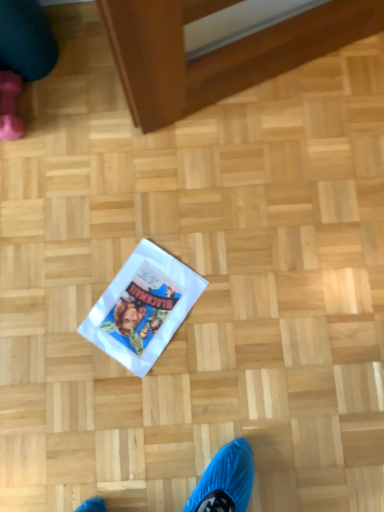
The image size is (384, 512). What do you see at coordinates (143, 307) in the screenshot?
I see `white paper flyer at center` at bounding box center [143, 307].

This screenshot has height=512, width=384. Identify the location of teal fabric leg at upper left. (22, 57).

You are a GUI agent. You are given a task and a screenshot of the screen. Output one action in this format:
    pyautogui.click(x=<x>, y=<y>)
    Task: Click on the pink rubber boot at upper left
    
    Given the screenshot: What is the action you would take?
    pyautogui.click(x=10, y=106)

From a real-world perspective, who is located lower, white paper flyer at center or teal fabric leg at upper left?

In real-world perspective, white paper flyer at center is lower.

Could teal fabric leg at upper left be considered to be inside white paper flyer at center?

No, teal fabric leg at upper left is not surrounded by white paper flyer at center.

Based on the photo, from the image's perspective, between white paper flyer at center and teal fabric leg at upper left, who is located below?

white paper flyer at center appears lower in the image.

Can you confirm if teal fabric leg at upper left is smaller than white paper flyer at center?

Actually, teal fabric leg at upper left might be larger than white paper flyer at center.

Is teal fabric leg at upper left positioned before white paper flyer at center?

Yes, the depth of teal fabric leg at upper left is less than that of white paper flyer at center.

From the picture: Is teal fabric leg at upper left positioned with its back to white paper flyer at center?

That's not correct — teal fabric leg at upper left is not looking away from white paper flyer at center.

Looking at this image, is teal fabric leg at upper left outside of pink rubber boot at upper left?

That's correct, teal fabric leg at upper left is outside of pink rubber boot at upper left.

Is teal fabric leg at upper left positioned behind pink rubber boot at upper left?

No, teal fabric leg at upper left is in front of pink rubber boot at upper left.

From the image's perspective, is teal fabric leg at upper left located above pink rubber boot at upper left?

Indeed, from the image's perspective, teal fabric leg at upper left is shown above pink rubber boot at upper left.

Which is nearer, (17,90) or (1,112)?

Point (17,90) appears to be farther away from the viewer than point (1,112).

From a real-world perspective, between pink rubber boot at upper left and teal fabric leg at upper left, who is vertically higher?

teal fabric leg at upper left is physically above.

Locate an element on the screen. The height and width of the screenshot is (512, 384). leg in front of the pink rubber boot at upper left is located at coordinates (22, 57).

Is pink rubber boot at upper left taller than teal fabric leg at upper left?

In fact, pink rubber boot at upper left may be shorter than teal fabric leg at upper left.

Can you confirm if pink rubber boot at upper left is taller than white paper flyer at center?

Correct, pink rubber boot at upper left is much taller as white paper flyer at center.

The width and height of the screenshot is (384, 512). In the image, there is a pink rubber boot at upper left. Identify the location of flyer below it (from the image's perspective). (143, 307).

Is point (4, 87) farther from viewer compared to point (185, 277)?

Yes.

Between pink rubber boot at upper left and white paper flyer at center, which one has smaller width?

pink rubber boot at upper left.

Measure the distance between white paper flyer at center and pink rubber boot at upper left.

white paper flyer at center is 23.03 inches from pink rubber boot at upper left.

Between point (153, 331) and point (7, 96), which one is positioned in front?

The point (153, 331) is more forward.

From the image's perspective, which object appears higher, white paper flyer at center or pink rubber boot at upper left?

pink rubber boot at upper left appears higher in the image.

Is white paper flyer at center aimed at pink rubber boot at upper left?

No.

I want to click on leg above the white paper flyer at center (from a real-world perspective), so click(x=22, y=57).

Identify the location of flyer that appears below the teal fabric leg at upper left (from the image's perspective). (143, 307).

Estimate the real-world distances between objects in this image. Which object is further from white paper flyer at center, pink rubber boot at upper left or teal fabric leg at upper left?

A: Based on the image, teal fabric leg at upper left appears to be further to white paper flyer at center.

From the image, which object appears to be nearer to pink rubber boot at upper left, white paper flyer at center or teal fabric leg at upper left?

Based on the image, teal fabric leg at upper left appears to be nearer to pink rubber boot at upper left.

Estimate the real-world distances between objects in this image. Which object is further from teal fabric leg at upper left, pink rubber boot at upper left or white paper flyer at center?

white paper flyer at center.

Looking at the image, which one is located further to white paper flyer at center, teal fabric leg at upper left or pink rubber boot at upper left?

teal fabric leg at upper left.

Based on their spatial positions, is teal fabric leg at upper left or white paper flyer at center further from pink rubber boot at upper left?

white paper flyer at center.

Looking at the image, which one is located further to teal fabric leg at upper left, white paper flyer at center or pink rubber boot at upper left?

The object further to teal fabric leg at upper left is white paper flyer at center.

This screenshot has height=512, width=384. Find the location of `footwear between teal fabric leg at upper left and white paper flyer at center vertically`. footwear between teal fabric leg at upper left and white paper flyer at center vertically is located at coordinates (10, 106).